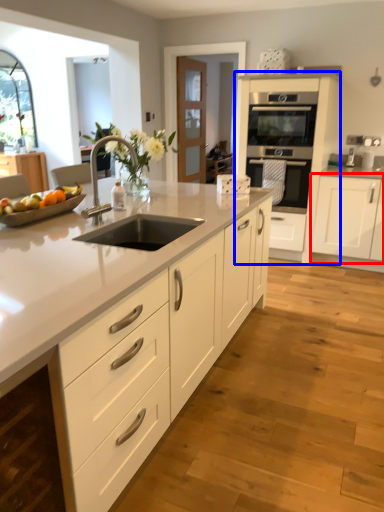
Question: Which of the following is the farthest to the observer, cabinetry (highlighted by a red box) or cabinetry (highlighted by a blue box)?

Choices:
 (A) cabinetry
 (B) cabinetry

Answer: (B)